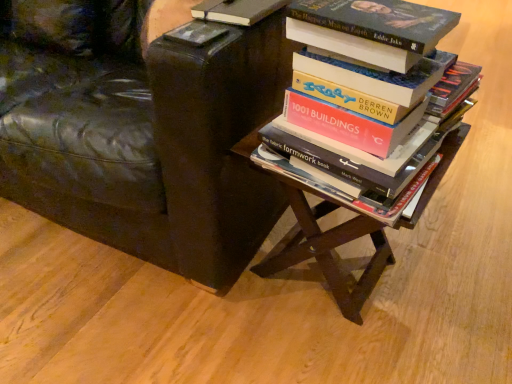
Where is `free region under wooden table at center (from a real-world perspective)`? The height and width of the screenshot is (384, 512). free region under wooden table at center (from a real-world perspective) is located at coordinates (326, 296).